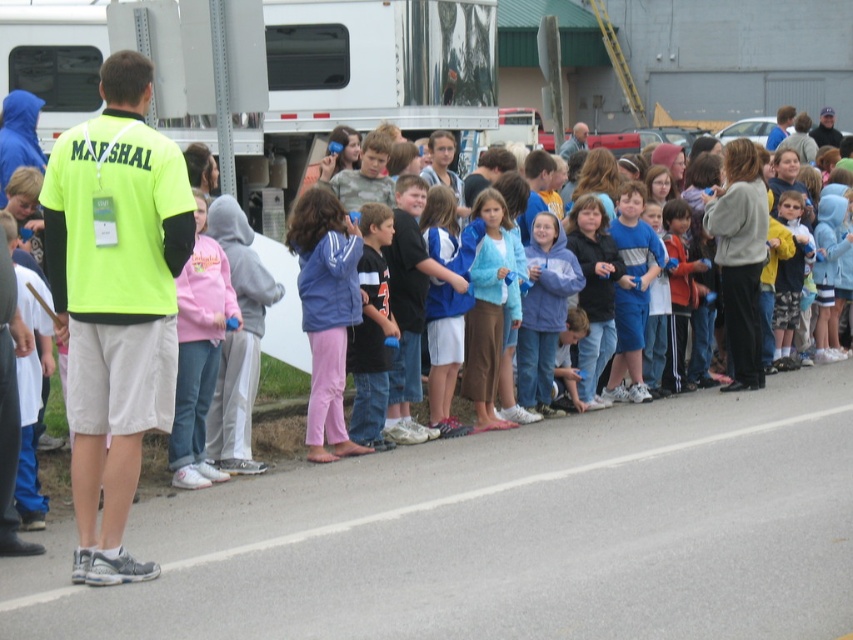
Can you confirm if neon yellow shirt at left is wider than pink fleece jacket at center?

Correct, the width of neon yellow shirt at left exceeds that of pink fleece jacket at center.

Does neon yellow shirt at left have a larger size compared to pink fleece jacket at center?

Indeed, neon yellow shirt at left has a larger size compared to pink fleece jacket at center.

Who is more distant from viewer, (154, 250) or (193, 461)?

Positioned behind is point (193, 461).

Where is `neon yellow shirt at left`? neon yellow shirt at left is located at coordinates (115, 301).

Is silver metallic trailer truck at center to the right of pink fleece jacket at center from the viewer's perspective?

Incorrect, silver metallic trailer truck at center is not on the right side of pink fleece jacket at center.

Is silver metallic trailer truck at center above pink fleece jacket at center?

Yes.

Between point (300, 100) and point (194, 435), which one is positioned behind?

Positioned behind is point (300, 100).

Where is `silver metallic trailer truck at center`? The width and height of the screenshot is (853, 640). silver metallic trailer truck at center is located at coordinates (370, 70).

Is neon yellow shirt at left behind silver metallic trailer truck at center?

No.

Is point (109, 394) closer to camera compared to point (428, 26)?

Yes, it is.

Locate an element on the screen. The height and width of the screenshot is (640, 853). neon yellow shirt at left is located at coordinates point(115,301).